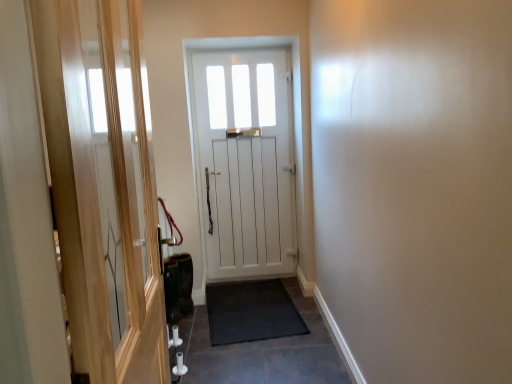
Find the location of a particular element. Image resolution: width=512 pixels, height=384 pixels. free spot above black rubber doormat at center (from a real-world perspective) is located at coordinates (247, 313).